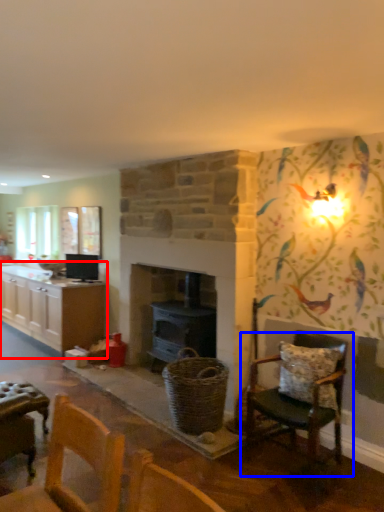
Question: Among these objects, which one is farthest to the camera, cabinetry (highlighted by a red box) or chair (highlighted by a blue box)?

Choices:
 (A) cabinetry
 (B) chair

Answer: (A)